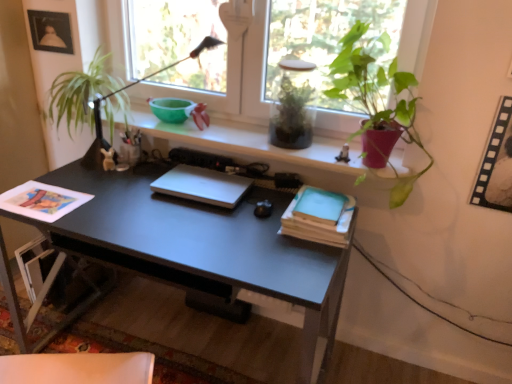
Question: From the image's perspective, is white matte laptop at center below filmstrip paper at upper right, the 1th picture frame ordered from the bottom?

Choices:
 (A) no
 (B) yes

Answer: (B)

Question: From the image's perspective, is white matte laptop at center above filmstrip paper at upper right, acting as the second picture frame starting from the top?

Choices:
 (A) yes
 (B) no

Answer: (B)

Question: Is white matte laptop at center facing away from filmstrip paper at upper right, which is the 1th picture frame from right to left?

Choices:
 (A) yes
 (B) no

Answer: (B)

Question: From a real-world perspective, is white matte laptop at center beneath filmstrip paper at upper right, acting as the second picture frame starting from the top?

Choices:
 (A) yes
 (B) no

Answer: (A)

Question: Can you confirm if white matte laptop at center is thinner than filmstrip paper at upper right, which is the 1th picture frame from right to left?

Choices:
 (A) yes
 (B) no

Answer: (B)

Question: Based on their positions, is white matte laptop at center located to the left or right of black matte desk at center?

Choices:
 (A) right
 (B) left

Answer: (A)

Question: From a real-world perspective, is white matte laptop at center above or below black matte desk at center?

Choices:
 (A) above
 (B) below

Answer: (A)

Question: From the image's perspective, is white matte laptop at center located above or below black matte desk at center?

Choices:
 (A) above
 (B) below

Answer: (A)

Question: In terms of width, does white matte laptop at center look wider or thinner when compared to black matte desk at center?

Choices:
 (A) thin
 (B) wide

Answer: (A)

Question: From a real-world perspective, is light blue matte paper at center right, the second paperback book when ordered from bottom to top, physically located above or below black matte desk at center?

Choices:
 (A) above
 (B) below

Answer: (A)

Question: From the image's perspective, relative to black matte desk at center, is light blue matte paper at center right, the second paperback book when ordered from bottom to top, above or below?

Choices:
 (A) below
 (B) above

Answer: (B)

Question: Relative to black matte desk at center, is light blue matte paper at center right, the first paperback book viewed from the top, in front or behind?

Choices:
 (A) front
 (B) behind

Answer: (B)

Question: Is light blue matte paper at center right, the first paperback book viewed from the top, spatially inside black matte desk at center, or outside of it?

Choices:
 (A) inside
 (B) outside

Answer: (B)

Question: Is black matte desk at center in front of or behind light blue paper at center right, the 1th paperback book ordered from the bottom, in the image?

Choices:
 (A) behind
 (B) front

Answer: (B)

Question: From a real-world perspective, is black matte desk at center above or below light blue paper at center right, the 1th paperback book ordered from the bottom?

Choices:
 (A) below
 (B) above

Answer: (A)